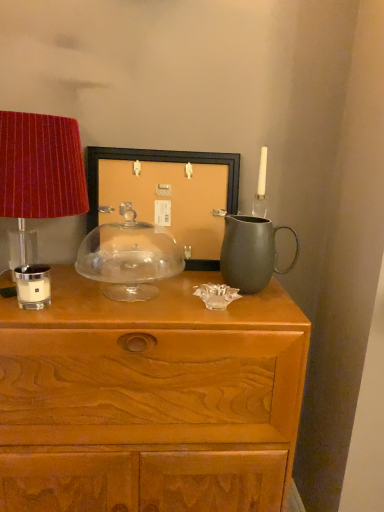
This screenshot has width=384, height=512. In order to click on free space between matte gray jug at right and white matte candle holder at left, which is the 1th candle holder from left to right in this screenshot , I will do `click(138, 297)`.